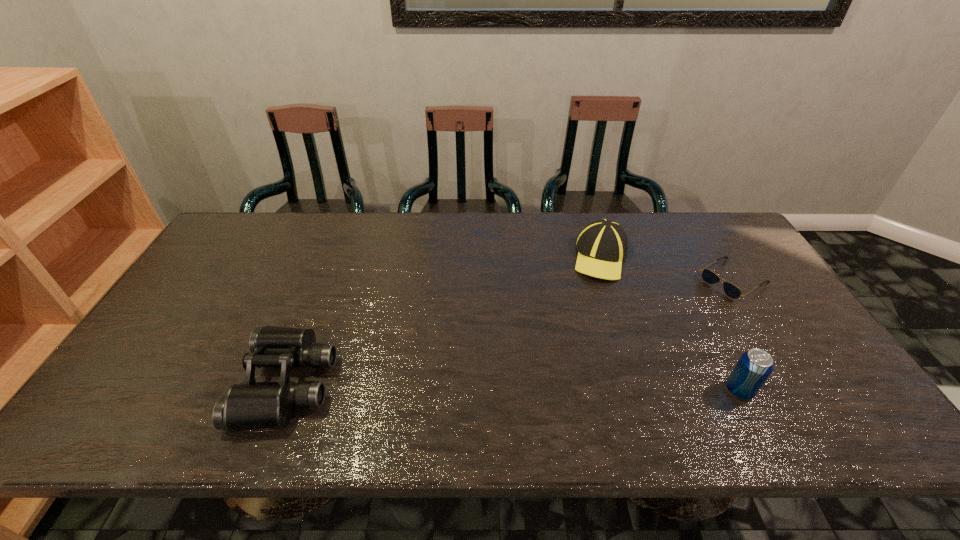
Identify the location of binoculars. (250, 405).

Locate an element on the screen. the third object from left to right is located at coordinates [753, 368].

Identify the location of sunglasses. click(732, 291).

The width and height of the screenshot is (960, 540). In order to click on the rightmost object in this screenshot , I will do `click(732, 291)`.

You are a GUI agent. You are given a task and a screenshot of the screen. Output one action in this format:
    pyautogui.click(x=<x>, y=<y>)
    Task: Click on the third object from right to left
    This screenshot has width=960, height=540.
    Given the screenshot: What is the action you would take?
    pyautogui.click(x=602, y=245)

Find the location of a particular element. Image resolution: width=960 pixels, height=540 pixels. blank space located on the front-facing side of the leftmost object is located at coordinates (181, 384).

Image resolution: width=960 pixels, height=540 pixels. In order to click on vacant area situated 0.280m on the front-facing side of the leftmost object in this screenshot , I will do `click(127, 384)`.

This screenshot has width=960, height=540. What are the coordinates of `free space located on the front-facing side of the leftmost object` in the screenshot? It's located at (118, 384).

Identify the location of vacant region located on the left of the beer can. (572, 390).

At what (x,y) coordinates should I click in order to perform the action: click on vacant space located 0.310m on the front-facing side of the sunglasses. Please return your answer as a coordinate pair (x, y). Image resolution: width=960 pixels, height=540 pixels. Looking at the image, I should click on (641, 339).